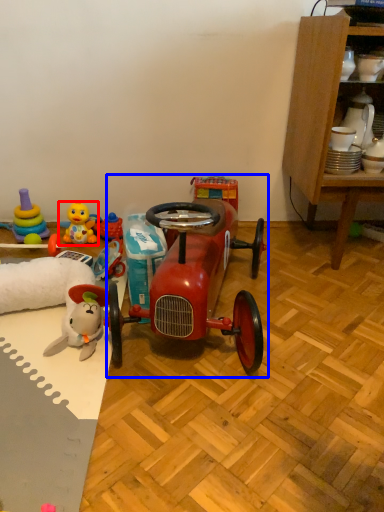
Question: Which object is further to the camera taking this photo, toy (highlighted by a red box) or model car (highlighted by a blue box)?

Choices:
 (A) toy
 (B) model car

Answer: (A)